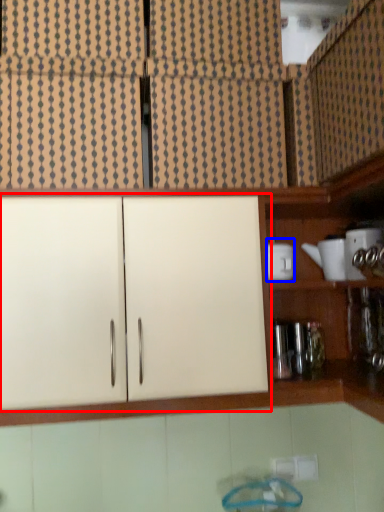
Question: Which object appears farthest to the camera in this image, cabinetry (highlighted by a red box) or appliance (highlighted by a blue box)?

Choices:
 (A) cabinetry
 (B) appliance

Answer: (B)